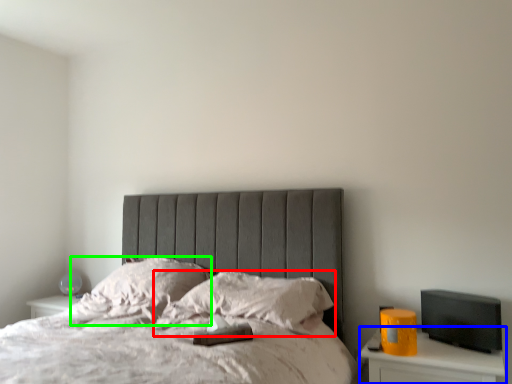
Question: Based on their relative distances, which object is nearer to pillow (highlighted by a red box)? Choose from nightstand (highlighted by a blue box) and pillow (highlighted by a green box).

Choices:
 (A) nightstand
 (B) pillow

Answer: (B)